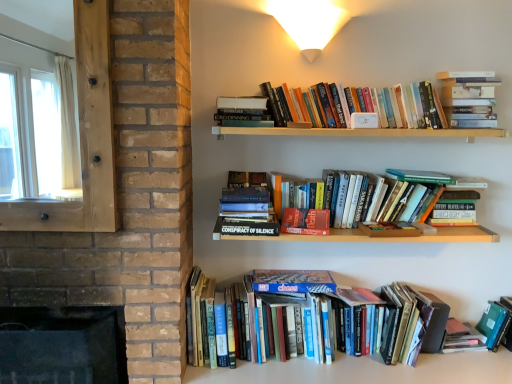
Image resolution: width=512 pixels, height=384 pixels. I want to click on empty space that is ontop of white matte wall sconce at upper center (from a real-world perspective), so click(310, 7).